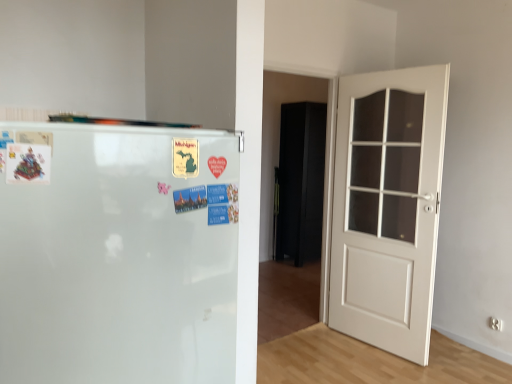
Question: Considering the relative sizes of black matte armoire at center and white wooden door at right in the image provided, is black matte armoire at center bigger than white wooden door at right?

Choices:
 (A) yes
 (B) no

Answer: (B)

Question: Does black matte armoire at center contain white wooden door at right?

Choices:
 (A) yes
 (B) no

Answer: (B)

Question: From the image's perspective, does black matte armoire at center appear higher than white wooden door at right?

Choices:
 (A) yes
 (B) no

Answer: (A)

Question: Is black matte armoire at center closer to camera compared to white wooden door at right?

Choices:
 (A) no
 (B) yes

Answer: (A)

Question: Is black matte armoire at center shorter than white wooden door at right?

Choices:
 (A) yes
 (B) no

Answer: (A)

Question: From a real-world perspective, is black matte armoire at center positioned under white wooden door at right based on gravity?

Choices:
 (A) no
 (B) yes

Answer: (B)

Question: Can we say white glossy refrigerator at left lies outside clear glass door at right?

Choices:
 (A) yes
 (B) no

Answer: (A)

Question: Could clear glass door at right be considered to be inside white glossy refrigerator at left?

Choices:
 (A) yes
 (B) no

Answer: (B)

Question: Could you tell me if white glossy refrigerator at left is turned towards clear glass door at right?

Choices:
 (A) yes
 (B) no

Answer: (B)

Question: From a real-world perspective, is white glossy refrigerator at left beneath clear glass door at right?

Choices:
 (A) no
 (B) yes

Answer: (B)

Question: Can you confirm if white glossy refrigerator at left is wider than clear glass door at right?

Choices:
 (A) no
 (B) yes

Answer: (B)

Question: Does white glossy refrigerator at left have a greater height compared to clear glass door at right?

Choices:
 (A) no
 (B) yes

Answer: (A)

Question: Would you say white glossy refrigerator at left is a long distance from white wooden door at right?

Choices:
 (A) no
 (B) yes

Answer: (B)